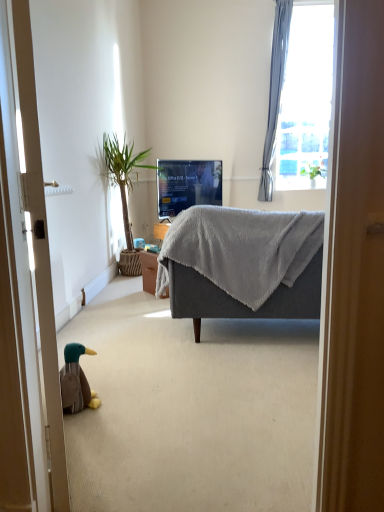
Question: Does brown plush duck at lower left lie in front of green leafy plant at upper right?

Choices:
 (A) no
 (B) yes

Answer: (B)

Question: From the image's perspective, would you say brown plush duck at lower left is shown under green leafy plant at upper right?

Choices:
 (A) yes
 (B) no

Answer: (A)

Question: Is brown plush duck at lower left outside green leafy plant at upper right?

Choices:
 (A) no
 (B) yes

Answer: (B)

Question: From the image's perspective, is brown plush duck at lower left above green leafy plant at upper right?

Choices:
 (A) yes
 (B) no

Answer: (B)

Question: Is brown plush duck at lower left to the left of green leafy plant at upper right from the viewer's perspective?

Choices:
 (A) no
 (B) yes

Answer: (B)

Question: Is brown plush duck at lower left looking in the opposite direction of green leafy plant at upper right?

Choices:
 (A) no
 (B) yes

Answer: (A)

Question: Does matte black tv at center have a larger size compared to brown plush duck at lower left?

Choices:
 (A) no
 (B) yes

Answer: (B)

Question: Does matte black tv at center have a greater height compared to brown plush duck at lower left?

Choices:
 (A) no
 (B) yes

Answer: (B)

Question: Could you tell me if matte black tv at center is turned towards brown plush duck at lower left?

Choices:
 (A) no
 (B) yes

Answer: (A)

Question: Can you confirm if matte black tv at center is smaller than brown plush duck at lower left?

Choices:
 (A) no
 (B) yes

Answer: (A)

Question: Is the depth of matte black tv at center greater than that of brown plush duck at lower left?

Choices:
 (A) yes
 (B) no

Answer: (A)

Question: Is matte black tv at center shorter than brown plush duck at lower left?

Choices:
 (A) yes
 (B) no

Answer: (B)

Question: Is matte black tv at center not within green leafy plant at left?

Choices:
 (A) no
 (B) yes

Answer: (B)